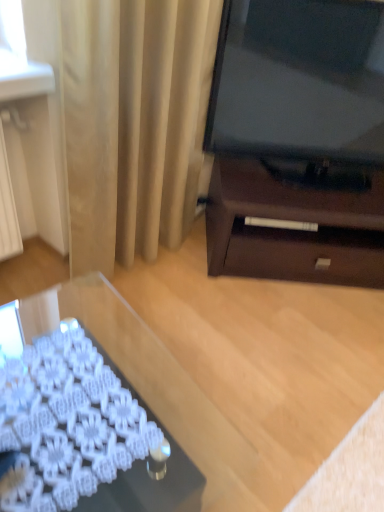
Locate an element on the screen. The image size is (384, 512). vacant space in front of beige fabric curtain at upper left is located at coordinates (137, 317).